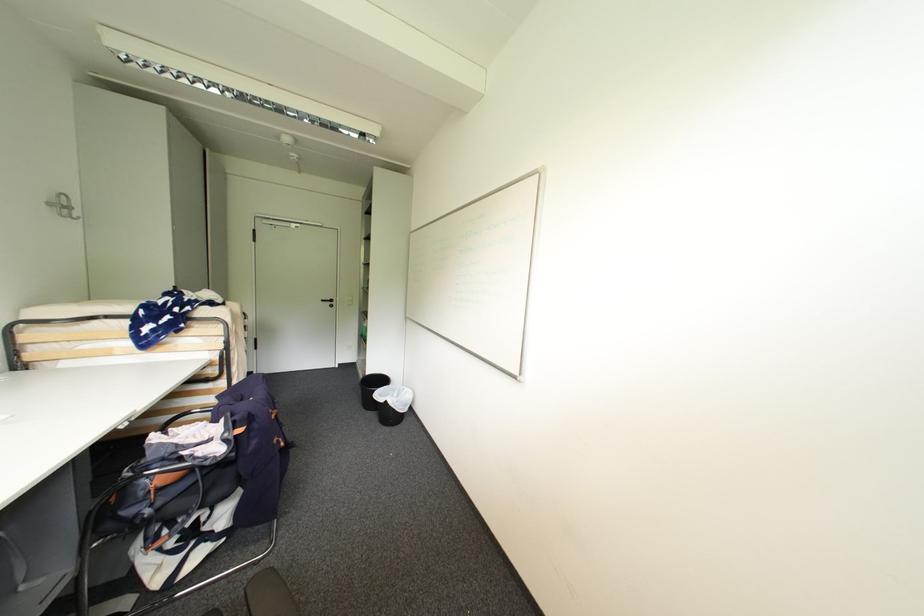
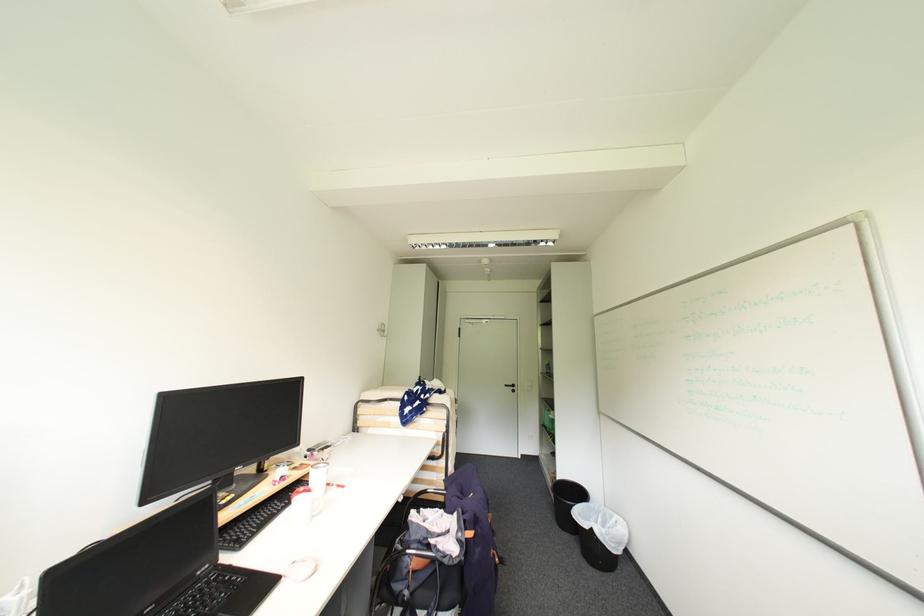
Find the pixel in the second image that matches the point at 330,302 in the first image.

(513, 387)